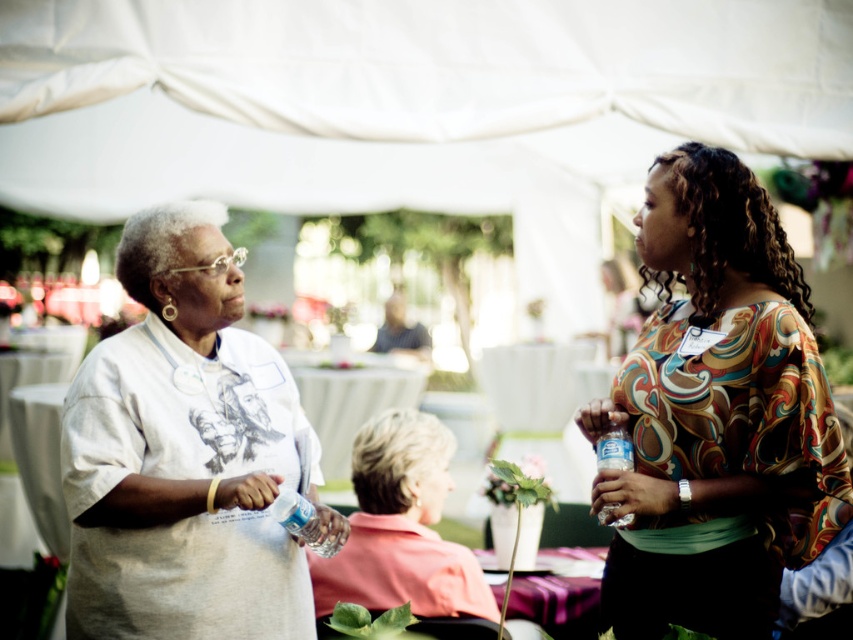
Question: Which object appears farthest from the camera in this image?

Choices:
 (A) light gray cotton shirt at left
 (B) clear plastic bottle at center
 (C) matte floral blouse at center

Answer: (B)

Question: Which of the following is the closest to the observer?

Choices:
 (A) clear plastic bottle at right
 (B) clear plastic bottle at center
 (C) matte floral blouse at center

Answer: (C)

Question: Which of the following is the farthest from the observer?

Choices:
 (A) (322, 529)
 (B) (178, 595)
 (C) (811, 376)

Answer: (A)

Question: Is matte floral blouse at center further to the viewer compared to light gray cotton shirt at left?

Choices:
 (A) no
 (B) yes

Answer: (A)

Question: From the image, what is the correct spatial relationship of clear plastic bottle at center in relation to clear plastic bottle at right?

Choices:
 (A) above
 (B) below

Answer: (B)

Question: Is light gray cotton shirt at left smaller than clear plastic bottle at center?

Choices:
 (A) yes
 (B) no

Answer: (B)